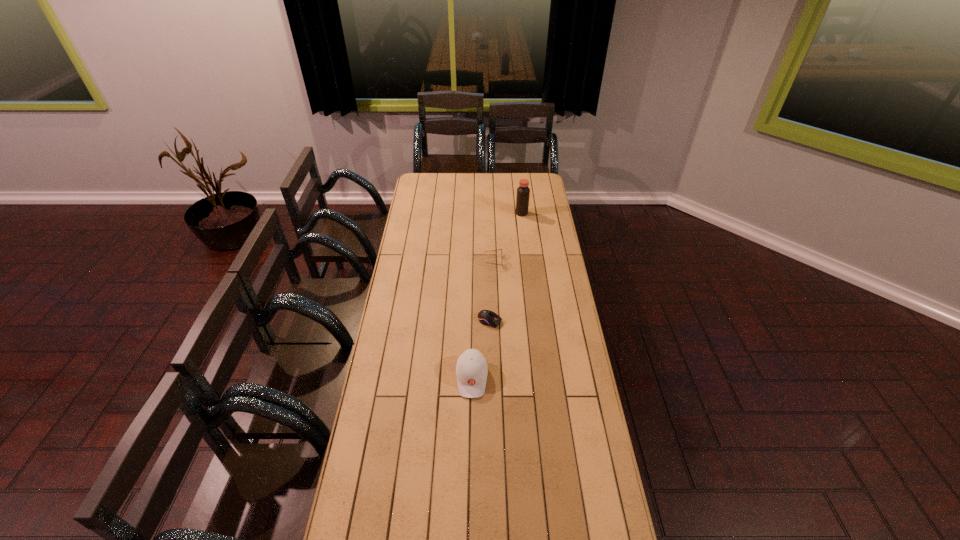
You are a GUI agent. You are given a task and a screenshot of the screen. Output one action in this format:
    pyautogui.click(x=<x>, y=<y>)
    Task: Click on the vacant region located 0.170m on the front-facing side of the third nearest object
    
    Given the screenshot: What is the action you would take?
    pyautogui.click(x=451, y=261)

Identify the location of free space located 0.290m on the left of the third farthest object. [x=413, y=321].

What are the coordinates of `object situated at the right edge` in the screenshot? It's located at (523, 192).

The image size is (960, 540). What are the coordinates of `free space at the far edge of the desktop` in the screenshot? It's located at click(x=513, y=174).

I want to click on vacant area at the left edge of the desktop, so click(x=403, y=236).

The image size is (960, 540). Identify the location of vacant region at the right edge of the desktop. (565, 526).

In order to click on vacant area at the far left corner of the desktop in this screenshot , I will do `click(415, 177)`.

Locate an element on the screen. Image resolution: width=960 pixels, height=540 pixels. vacant area between the tallest object and the third shortest object is located at coordinates (496, 295).

Image resolution: width=960 pixels, height=540 pixels. Find the location of `vacant area between the rightmost object and the computer mouse`. vacant area between the rightmost object and the computer mouse is located at coordinates (506, 267).

At what (x,y) coordinates should I click in order to perform the action: click on vacant region between the second farthest object and the computer mouse. Please return your answer as a coordinate pair (x, y). Looking at the image, I should click on (492, 291).